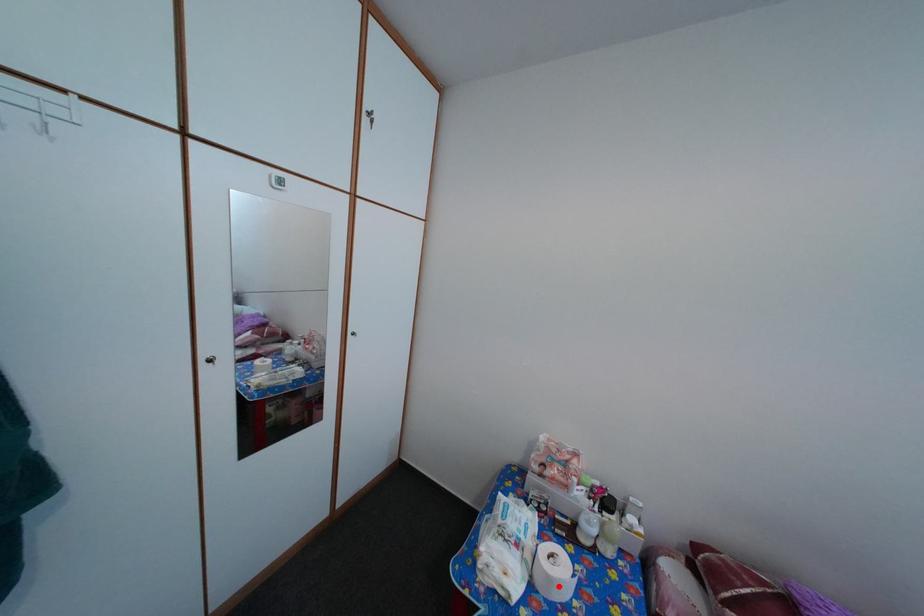
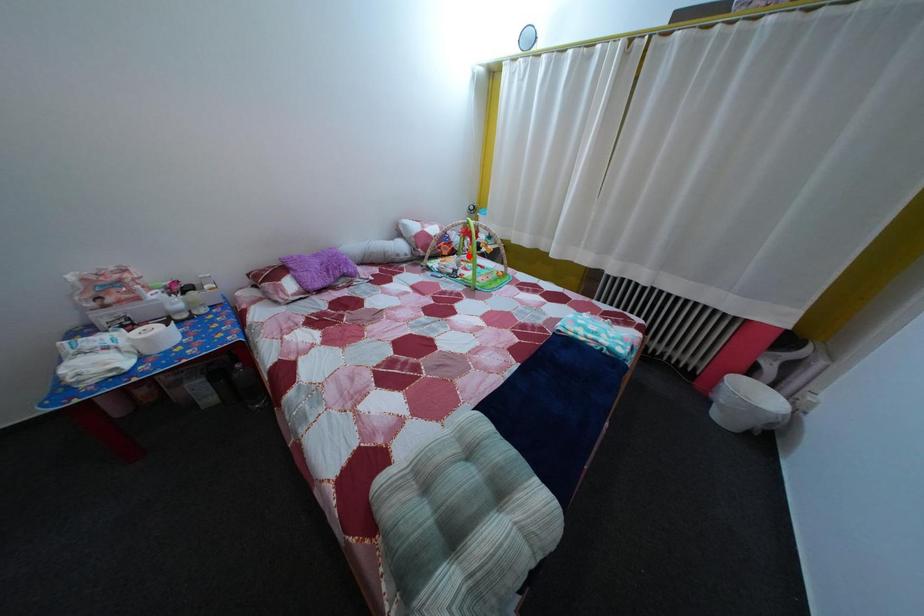
I am providing you with two images of the same scene from different viewpoints. A red point is marked on the first image and another point is marked on the second image. Is the red point in image1 aligned with the point shown in image2?

No